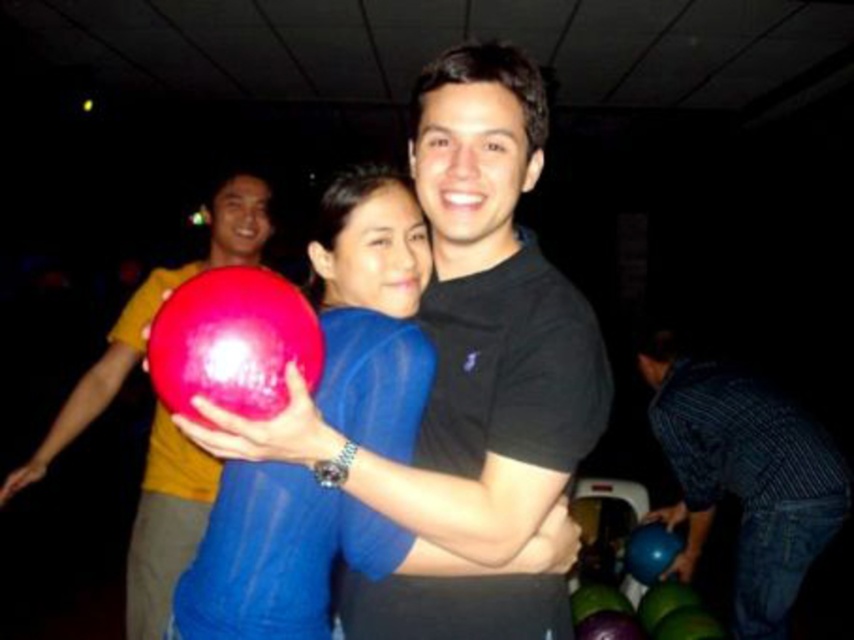
What do you see at coordinates (743, 476) in the screenshot?
I see `blue striped shirt at lower right` at bounding box center [743, 476].

Can you confirm if blue striped shirt at lower right is positioned to the right of rubberized red bowling ball at center?

Correct, you'll find blue striped shirt at lower right to the right of rubberized red bowling ball at center.

Is point (781, 484) positioned before point (240, 304)?

No, (781, 484) is further to viewer.

The image size is (854, 640). What are the coordinates of `blue striped shirt at lower right` in the screenshot? It's located at (743, 476).

Does blue striped shirt at lower right have a greater height compared to rubberized yellow bowling ball at center?

No, blue striped shirt at lower right is not taller than rubberized yellow bowling ball at center.

Is blue striped shirt at lower right wider than rubberized yellow bowling ball at center?

Incorrect, blue striped shirt at lower right's width does not surpass rubberized yellow bowling ball at center's.

Is point (688, 496) positioned after point (167, 566)?

Yes, point (688, 496) is farther from viewer.

Find the location of a particular element. This screenshot has height=640, width=854. blue striped shirt at lower right is located at coordinates (743, 476).

Is point (118, 369) positioned in front of point (162, 356)?

No.

Does point (211, 227) come farther from viewer compared to point (294, 316)?

Yes, it is.

Image resolution: width=854 pixels, height=640 pixels. Identify the location of rubberized yellow bowling ball at center. (151, 317).